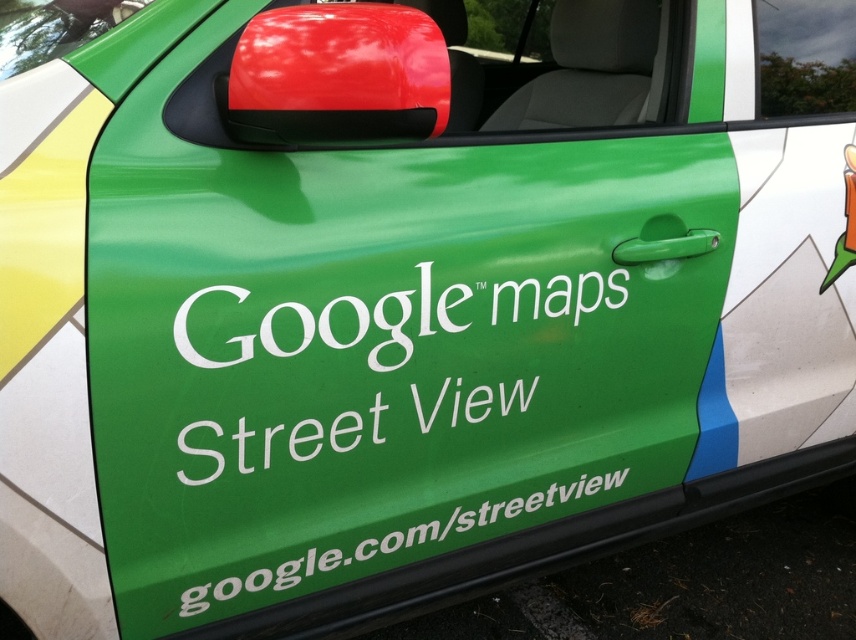
Question: Which point is closer to the camera?

Choices:
 (A) green matte text at center
 (B) white text on green at lower center

Answer: (A)

Question: Does green matte text at center have a smaller size compared to white text on green at lower center?

Choices:
 (A) yes
 (B) no

Answer: (B)

Question: Can you confirm if green matte text at center is positioned below white text on green at lower center?

Choices:
 (A) no
 (B) yes

Answer: (A)

Question: Is green matte text at center behind white text on green at lower center?

Choices:
 (A) no
 (B) yes

Answer: (A)

Question: Among these points, which one is farthest from the camera?

Choices:
 (A) (360, 314)
 (B) (509, 512)

Answer: (B)